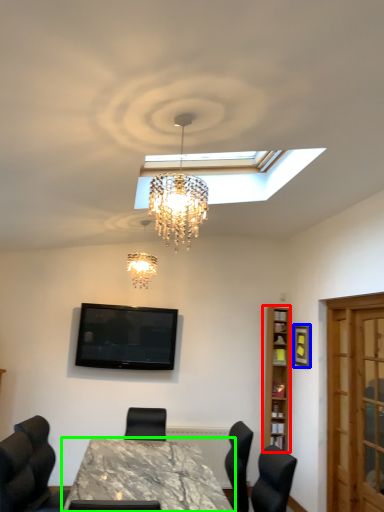
Question: Which is farther away from bookshelf (highlighted by a red box)? picture frame (highlighted by a blue box) or table (highlighted by a green box)?

Choices:
 (A) picture frame
 (B) table

Answer: (B)